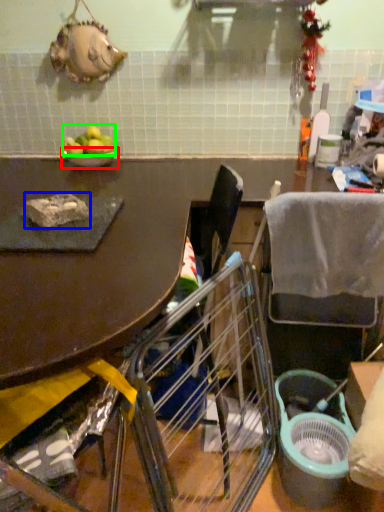
Question: Based on their relative distances, which object is nearer to bowl (highlighted by a red box)? Choose from food (highlighted by a blue box) and fruit (highlighted by a green box).

Choices:
 (A) food
 (B) fruit

Answer: (B)